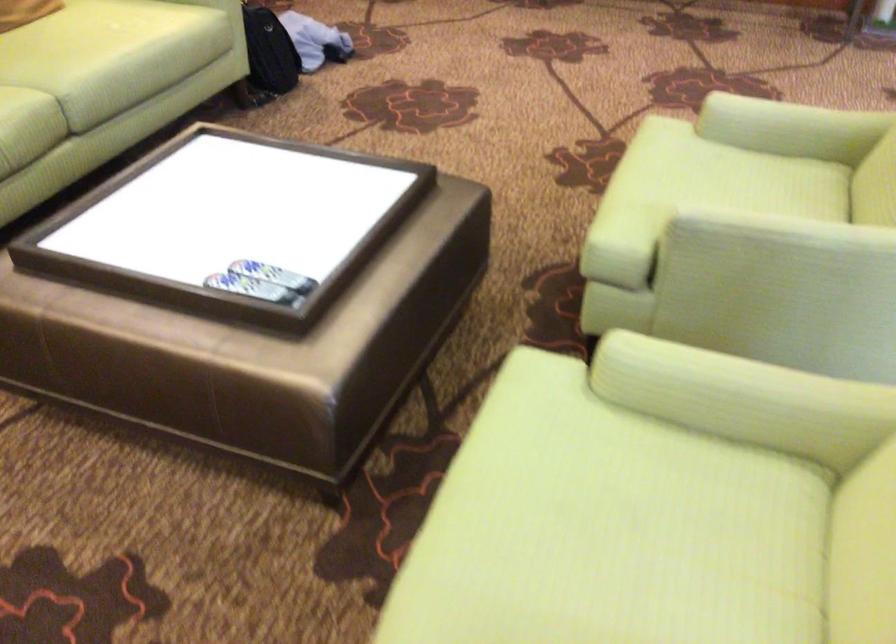
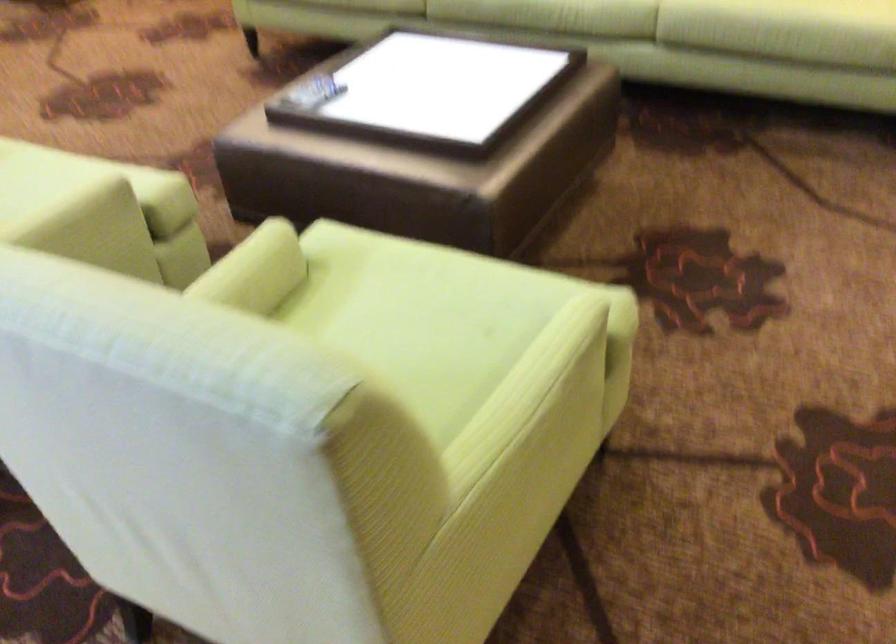
The point at (805, 108) is marked in the first image. Where is the corresponding point in the second image?

(528, 393)